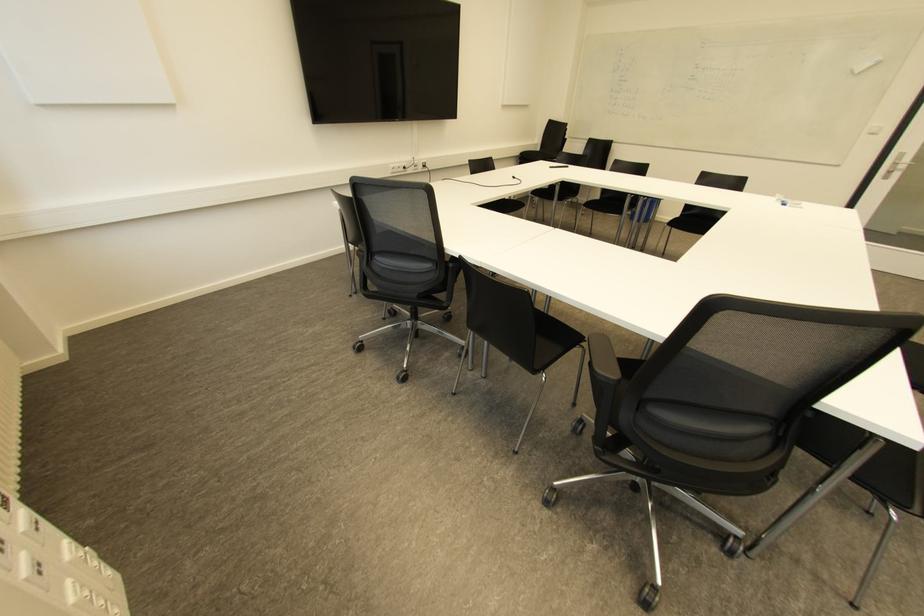
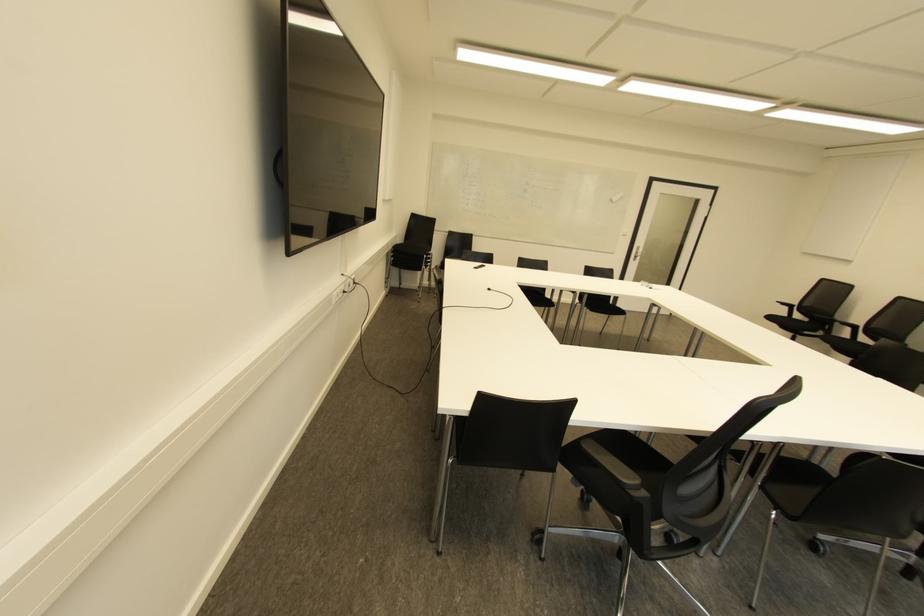
In the second image, find the point that corresponds to (x=423, y=166) in the first image.

(354, 282)